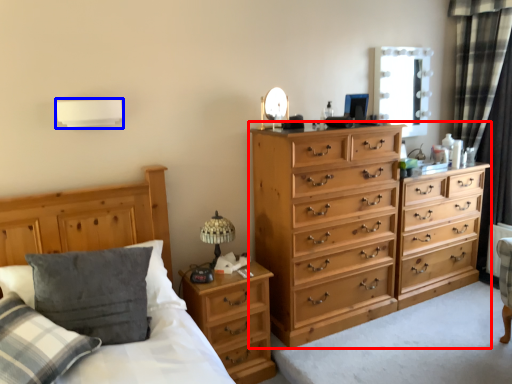
Question: Which of the following is the farthest to the observer, chest of drawers (highlighted by a red box) or lamp (highlighted by a blue box)?

Choices:
 (A) chest of drawers
 (B) lamp

Answer: (A)